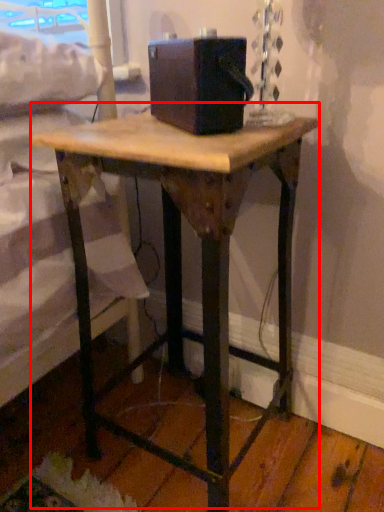
Question: Considering the relative positions of table (annotated by the red box) and box in the image provided, where is table (annotated by the red box) located with respect to the staircase?

Choices:
 (A) left
 (B) right

Answer: (A)